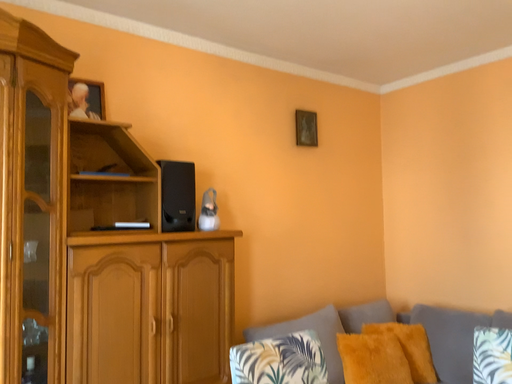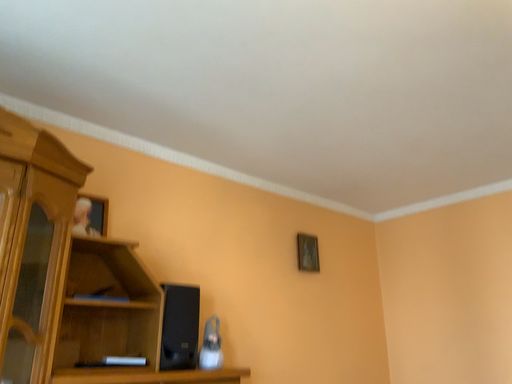
Question: How did the camera likely rotate when shooting the video?

Choices:
 (A) rotated downward
 (B) rotated upward

Answer: (B)